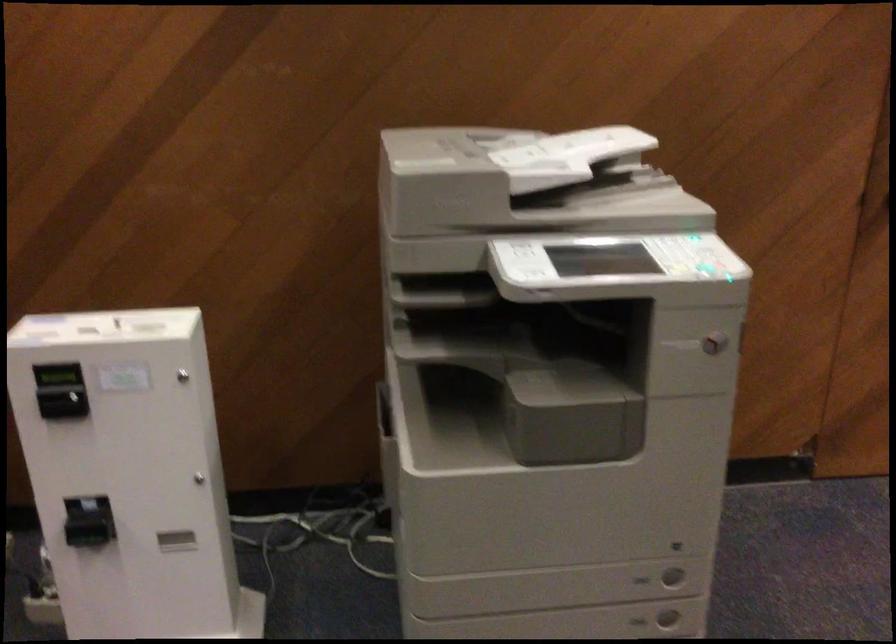
You are a GUI agent. You are given a task and a screenshot of the screen. Output one action in this format:
    pyautogui.click(x=<x>, y=<y>)
    Task: Click on the machine key lock
    This screenshot has width=896, height=644.
    Given the screenshot: What is the action you would take?
    click(183, 375)